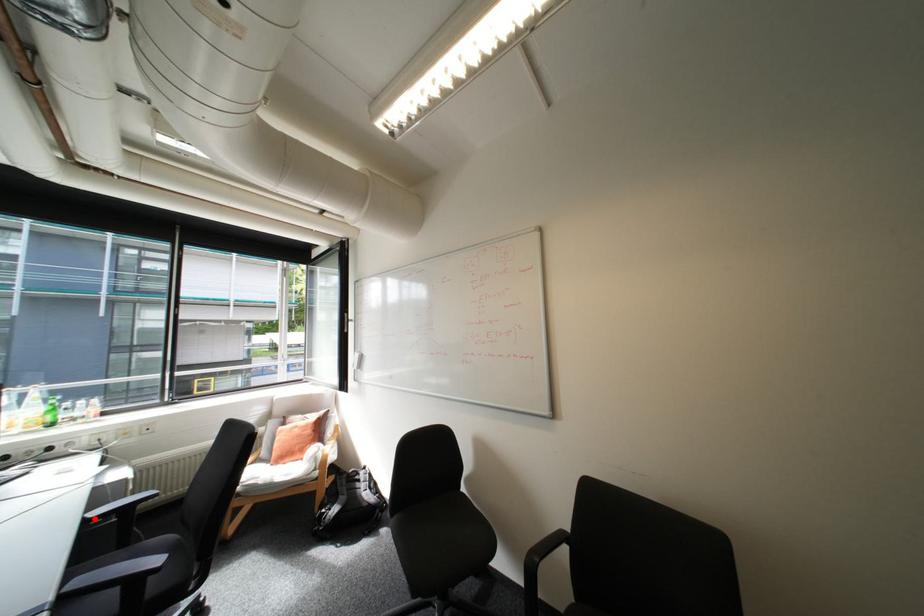
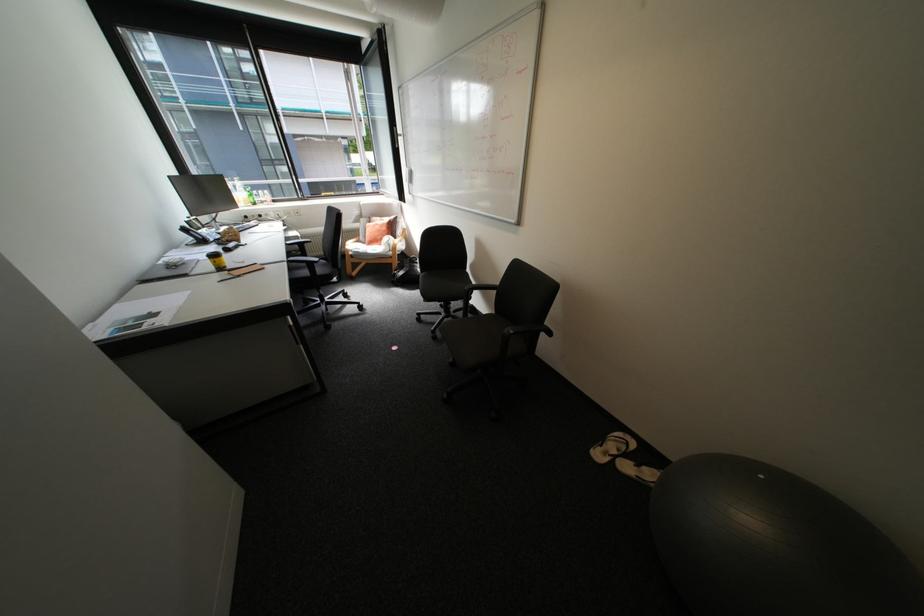
Find the pixel in the second image that matches the highlighted location in the first image.

(296, 244)